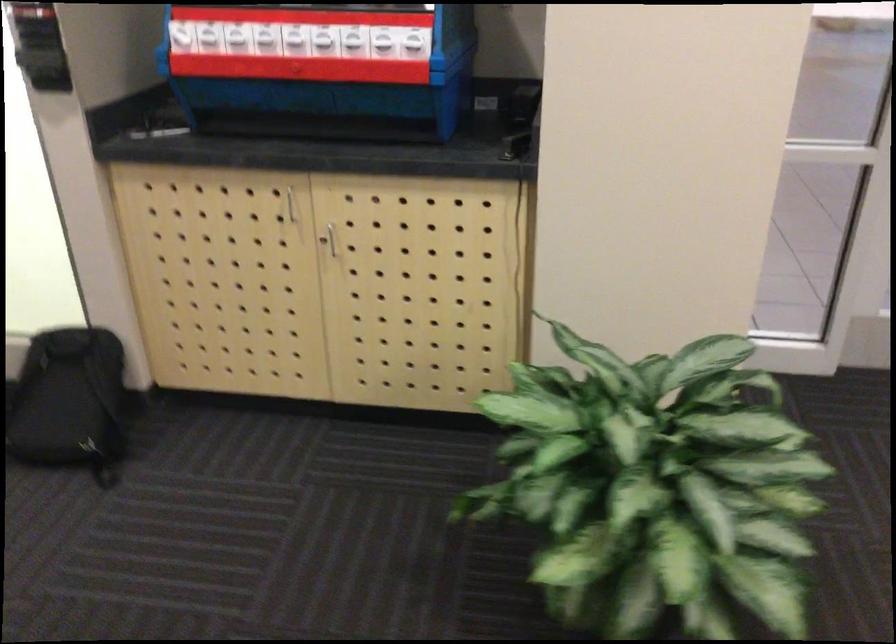
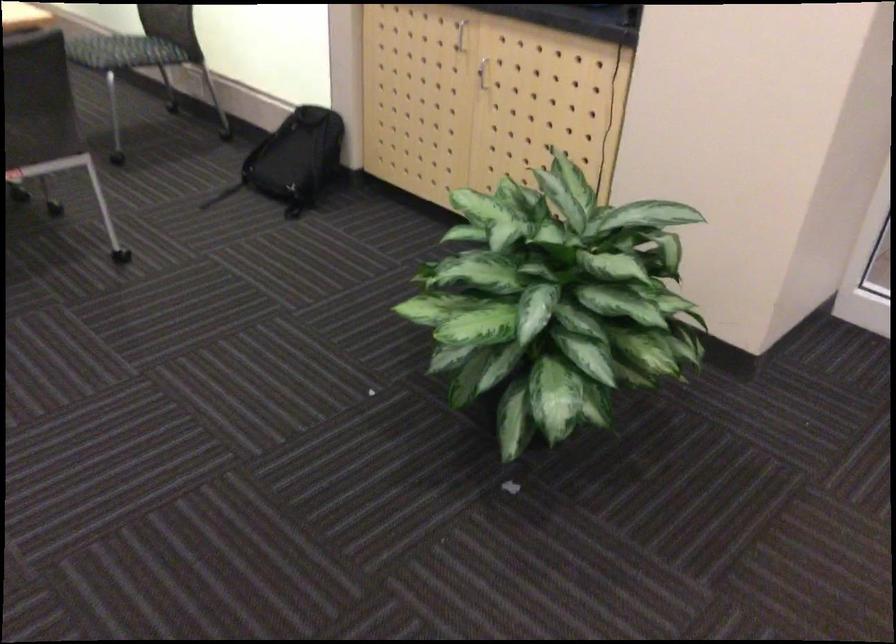
Find the pixel in the second image that matches (x=296, y=205) in the first image.

(460, 35)